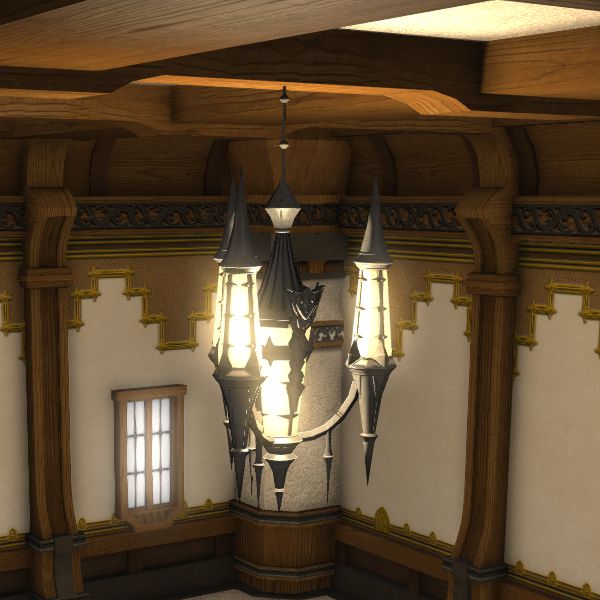
This screenshot has height=600, width=600. I want to click on ceiling, so click(345, 108).